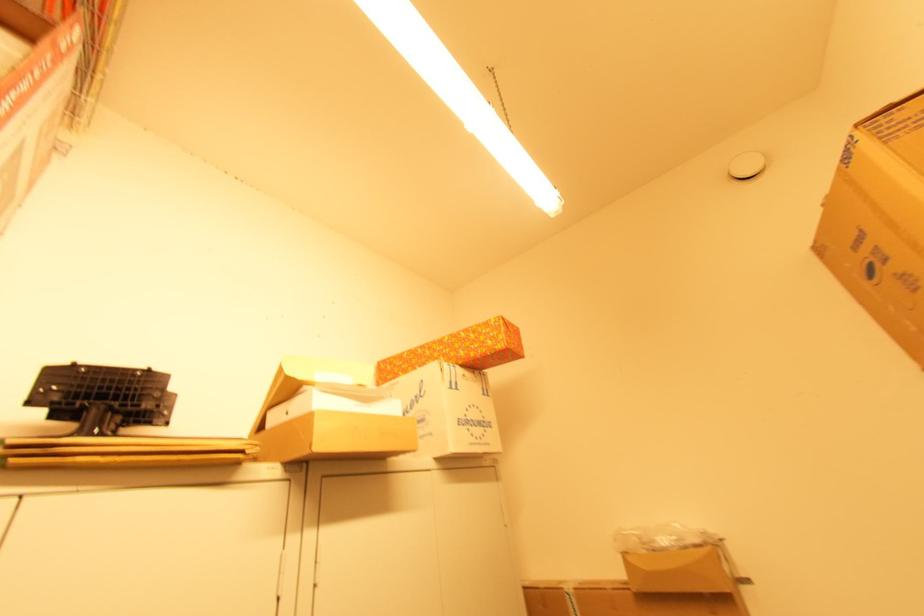
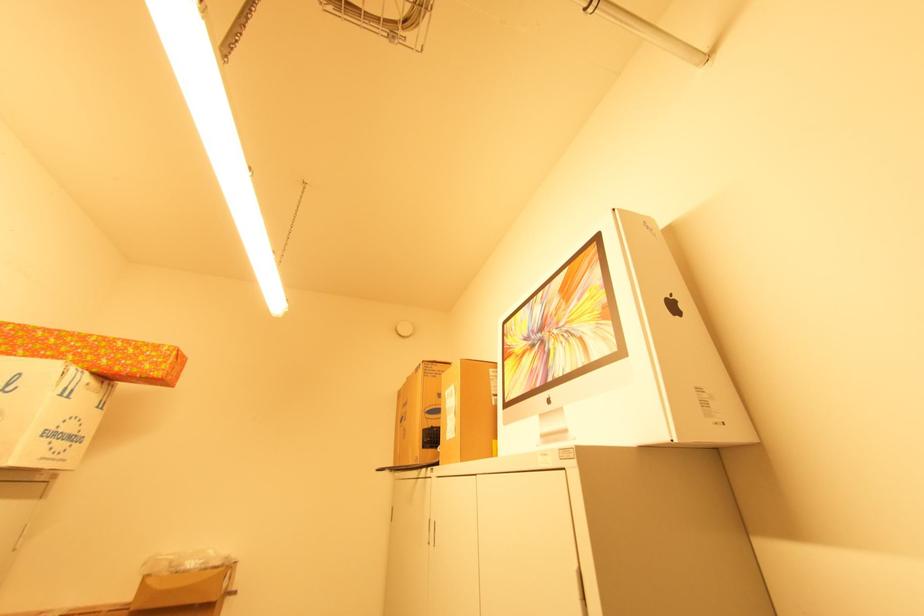
The images are taken continuously from a first-person perspective. In which direction is your viewpoint rotating?

The rotation direction of the camera is right-up.